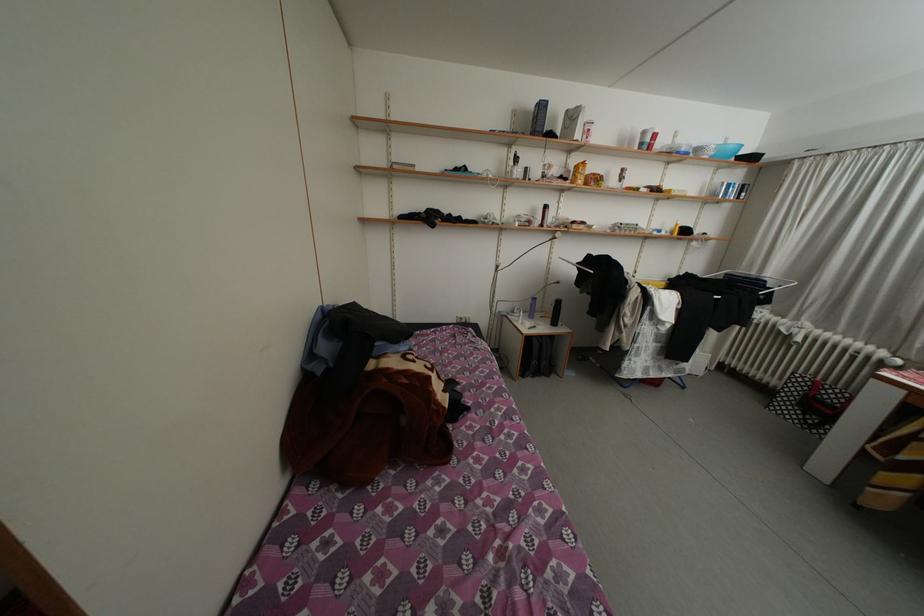
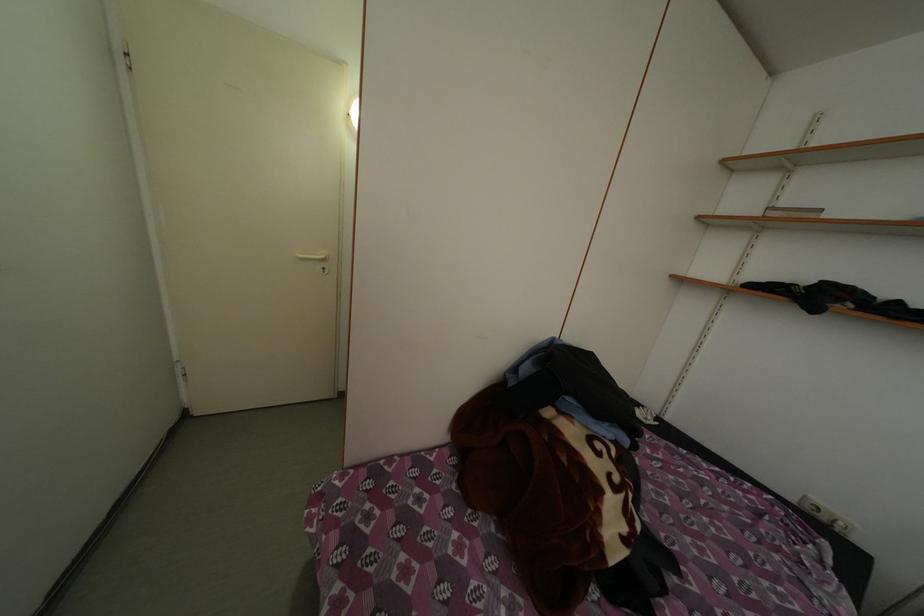
Question: The camera is either moving clockwise (left) or counter-clockwise (right) around the object. The first image is from the beginning of the video and the second image is from the end. Is the camera moving left or right when shooting the video?

Choices:
 (A) Left
 (B) Right

Answer: (B)